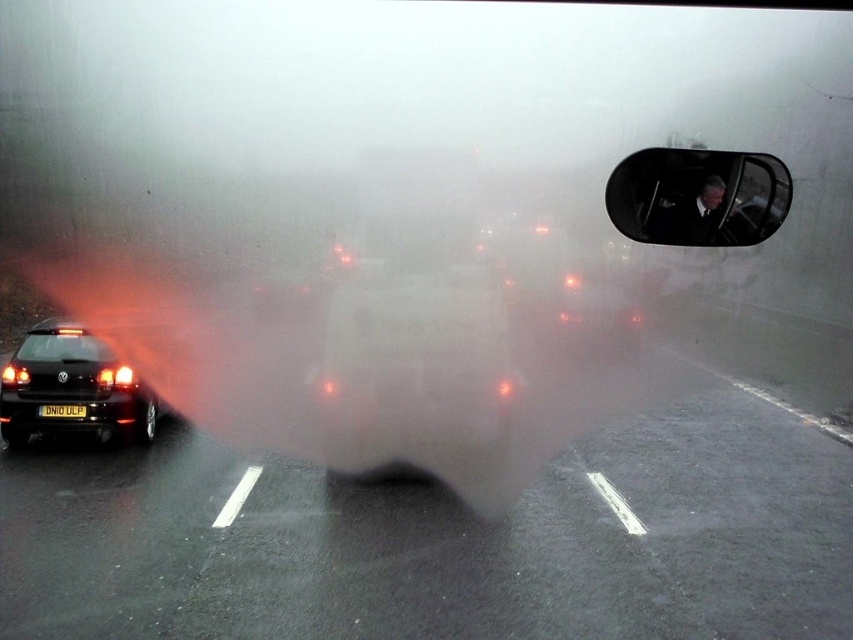
You are a pedestrian standing on the foggy road and see the shiny black car at left and the black plastic view mirror at upper right. Which object is closer to your right side?

The black plastic view mirror at upper right is positioned on the right side of the shiny black car at left, so it is closer to your right side.

You are a driver approaching the shiny black car at left and the transparent glass windshield at left. You need to pass through the space between them. Your car is 5 feet wide. Is there enough space to safely pass through?

The shiny black car at left and transparent glass windshield at left are 11.95 inches apart from each other. Since 11.95 inches is approximately 0.995 feet, which is less than the car width of 5 feet, there is not enough space to safely pass through.